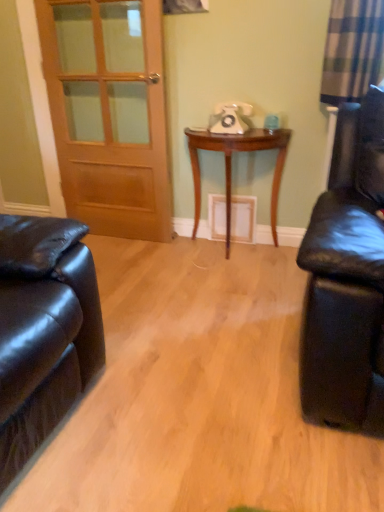
Where is `free space in front of wooden door at left`? free space in front of wooden door at left is located at coordinates (126, 263).